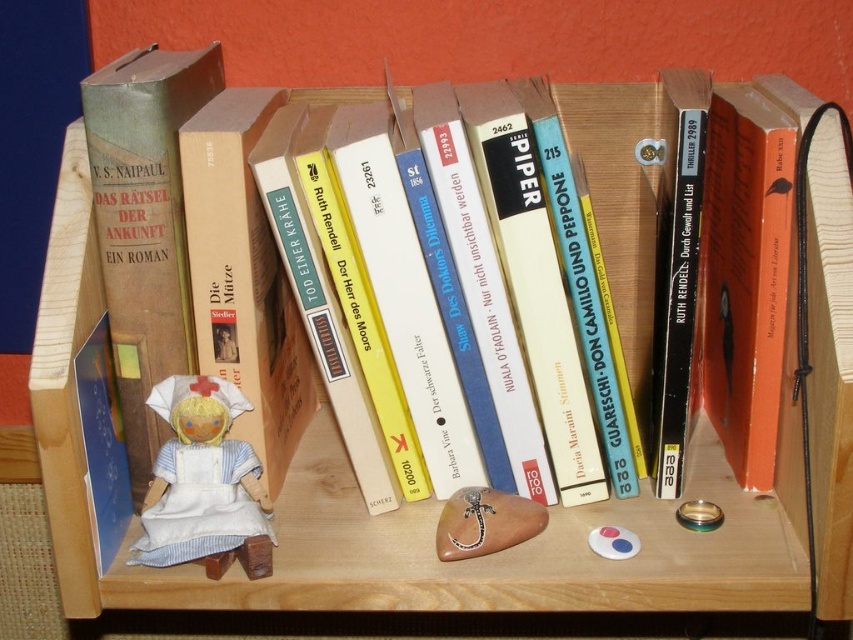
Question: Does white fabric doll at center appear over brown wooden spoon at center?

Choices:
 (A) no
 (B) yes

Answer: (B)

Question: Is white fabric doll at center positioned behind brown wooden spoon at center?

Choices:
 (A) yes
 (B) no

Answer: (B)

Question: Among these points, which one is nearest to the camera?

Choices:
 (A) (219, 440)
 (B) (518, 541)

Answer: (A)

Question: Which point is closer to the camera?

Choices:
 (A) (544, 515)
 (B) (247, 572)

Answer: (B)

Question: Does white fabric doll at center have a smaller size compared to brown wooden spoon at center?

Choices:
 (A) no
 (B) yes

Answer: (A)